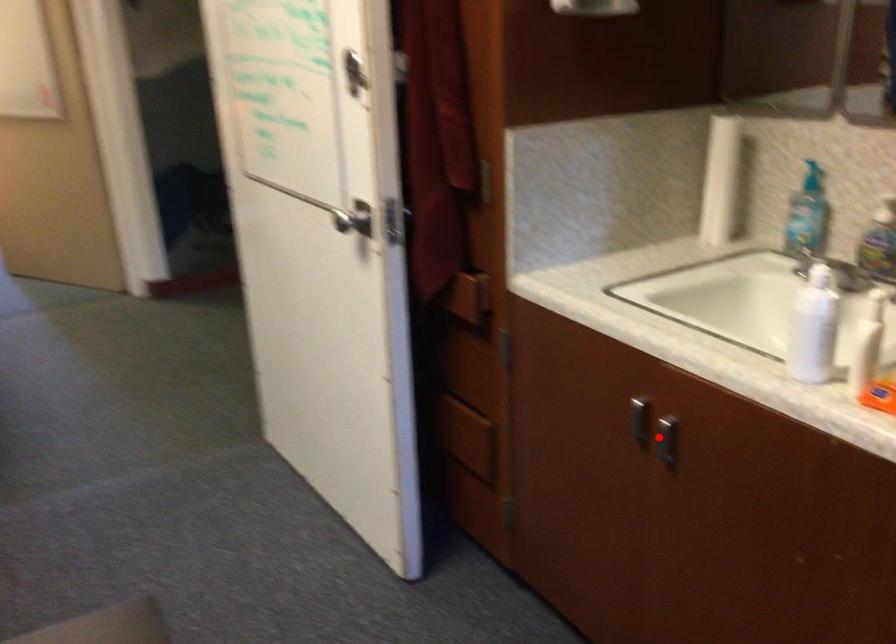
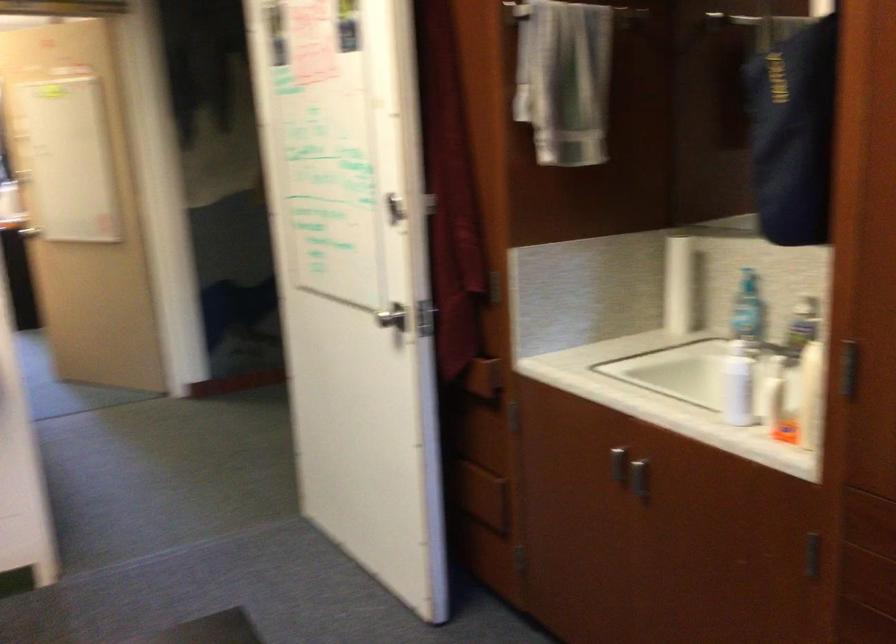
Locate, in the second image, the point that corresponds to the highlighted location in the first image.

(634, 477)